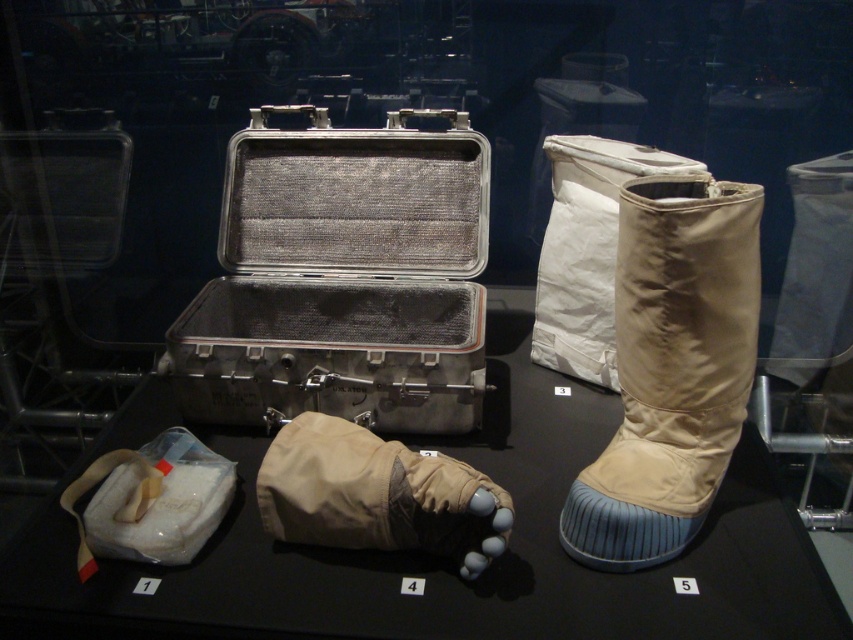
Question: Where is metallic mesh suitcase at center located in relation to beige fabric boot at right in the image?

Choices:
 (A) right
 (B) left

Answer: (B)

Question: Which of these objects is positioned closest to the white fabric bag at lower left?

Choices:
 (A) matte silver case at center
 (B) beige fabric glove at center

Answer: (A)

Question: Is beige fabric boot at upper right positioned in front of white fabric bag at lower left?

Choices:
 (A) no
 (B) yes

Answer: (A)

Question: Which is nearer to the beige fabric glove at center?

Choices:
 (A) beige fabric boot at right
 (B) matte silver case at center
 (C) beige fabric boot at upper right

Answer: (B)

Question: Which of the following is the closest to the observer?

Choices:
 (A) metallic mesh suitcase at center
 (B) white fabric bag at lower left
 (C) matte silver case at center
 (D) beige fabric boot at upper right

Answer: (C)

Question: Considering the relative positions of matte silver case at center and white fabric bag at lower left in the image provided, where is matte silver case at center located with respect to white fabric bag at lower left?

Choices:
 (A) right
 (B) left

Answer: (A)